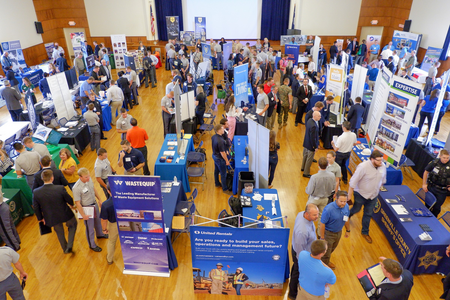
Image resolution: width=450 pixels, height=300 pixels. In order to click on wood floor in this screenshot , I will do `click(108, 286)`.